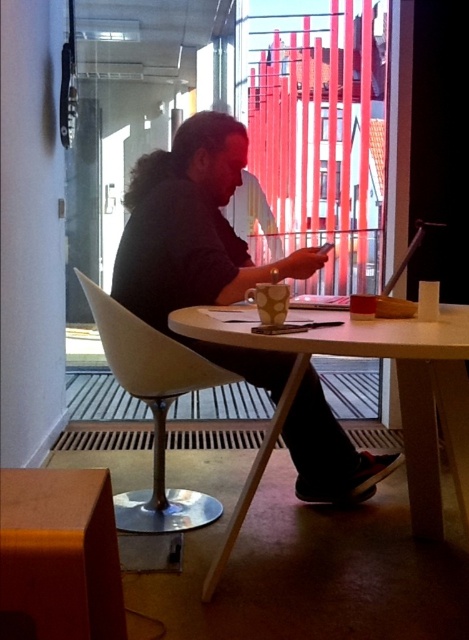
You are a person standing in the modern minimalist space. You want to hang a picture frame on the wall behind the dark gray hoodie at center and the white wood table at center. Which object should you move to ensure the frame can be placed above both?

Since the dark gray hoodie at center is taller than the white wood table at center, you should move the dark gray hoodie at center to ensure the frame can be placed above both.

You are a barista at the counter preparing drinks. You need to place a new order for the person sitting at the table. The order includes a large coffee that needs to be placed on the table. However, you notice that the table is already occupied by several items. To avoid spilling, you want to place the coffee as close as possible to the person without obstructing their view of their phone. Considering the dark gray hoodie at center and the matte white chair at center, which object should you position the 12

The dark gray hoodie at center is to the right of the matte white chair at center, so placing the coffee to the right of the matte white chair at center would be closer to the person while avoiding the hoodie. However, since the hoodie is already occupying space to the right of the chair, you might need to place the coffee slightly to the left of the hoodie at center or behind it to ensure it doesn